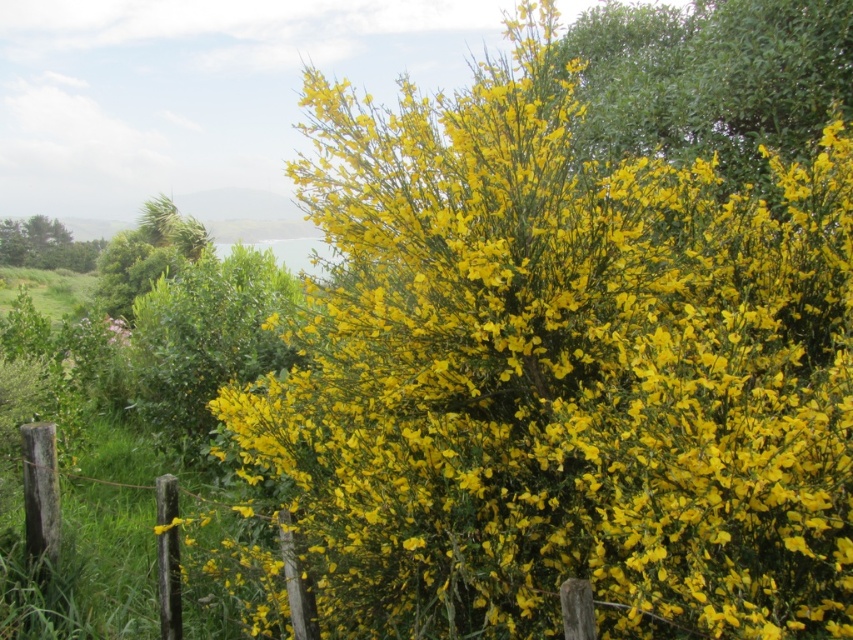
Question: Does yellow-green leafy bush at upper right have a larger size compared to green leafy bush at left?

Choices:
 (A) no
 (B) yes

Answer: (B)

Question: Is yellow-green leafy bush at upper right further to camera compared to green leafy bush at left?

Choices:
 (A) no
 (B) yes

Answer: (A)

Question: Among these objects, which one is farthest from the camera?

Choices:
 (A) yellow-green leafy bush at upper right
 (B) green leafy bush at left

Answer: (B)

Question: Which object appears closest to the camera in this image?

Choices:
 (A) green leafy bush at left
 (B) yellow-green leafy bush at upper right

Answer: (B)

Question: Is yellow-green leafy bush at upper right behind green leafy bush at left?

Choices:
 (A) no
 (B) yes

Answer: (A)